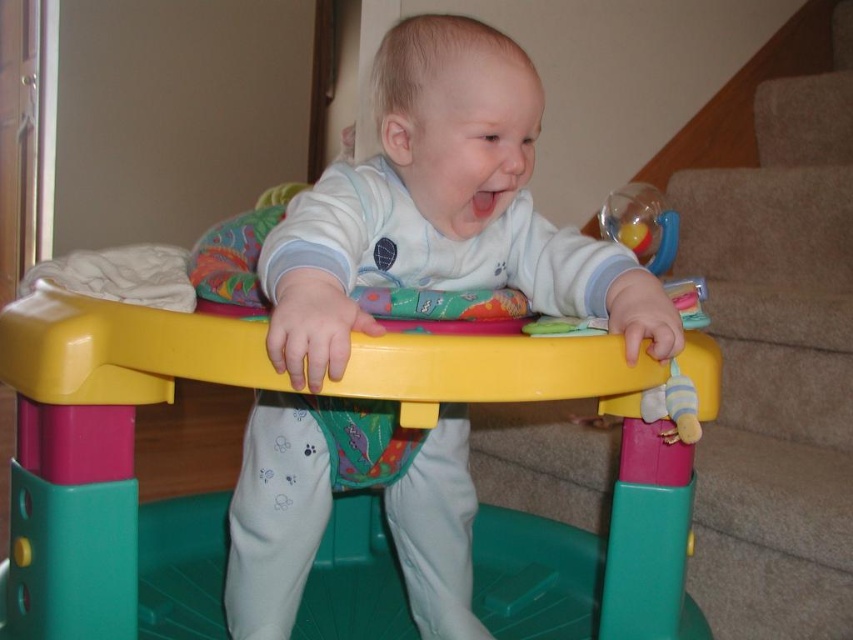
How far apart are white soft baby walker at center and plastic walker at center?

They are 6.77 inches apart.

Is white soft baby walker at center bigger than plastic walker at center?

Actually, white soft baby walker at center might be smaller than plastic walker at center.

Between point (276, 260) and point (548, 344), which one is positioned in front?

Positioned in front is point (548, 344).

Identify the location of white soft baby walker at center. (444, 209).

Does plastic walker at center have a lesser height compared to carpeted stair at lower right?

Yes.

Does plastic walker at center have a lesser width compared to carpeted stair at lower right?

Yes, plastic walker at center is thinner than carpeted stair at lower right.

You are a GUI agent. You are given a task and a screenshot of the screen. Output one action in this format:
    pyautogui.click(x=<x>, y=<y>)
    Task: Click on the plastic walker at center
    
    Given the screenshot: What is the action you would take?
    pyautogui.click(x=102, y=452)

What do you see at coordinates (444, 209) in the screenshot?
I see `white soft baby walker at center` at bounding box center [444, 209].

Who is positioned more to the left, white soft baby walker at center or carpeted stair at lower right?

From the viewer's perspective, white soft baby walker at center appears more on the left side.

Locate an element on the screen. The image size is (853, 640). white soft baby walker at center is located at coordinates (444, 209).

I want to click on white soft baby walker at center, so click(x=444, y=209).